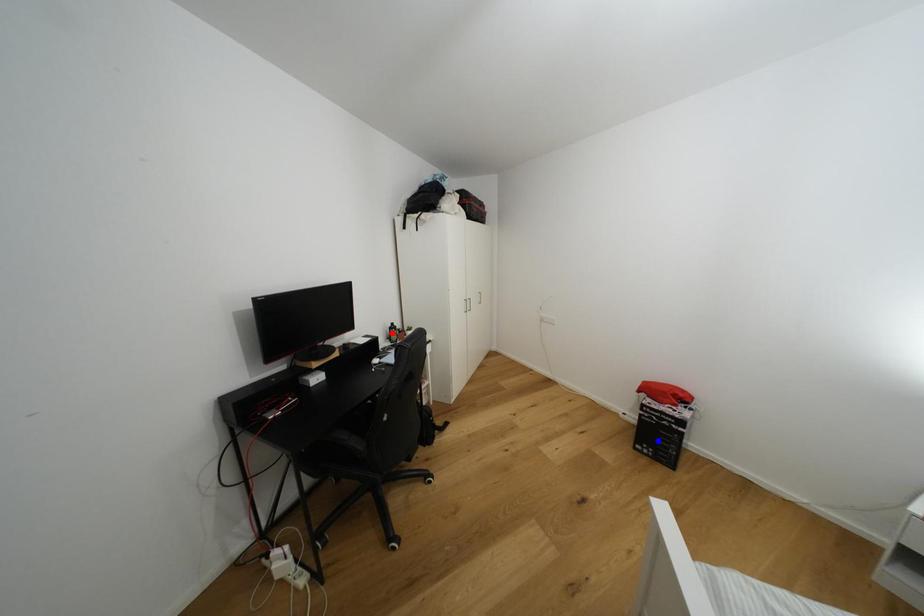
Question: Two points are marked on the image. Which point is closer to the camera?

Choices:
 (A) Blue point is closer.
 (B) Red point is closer.

Answer: (A)